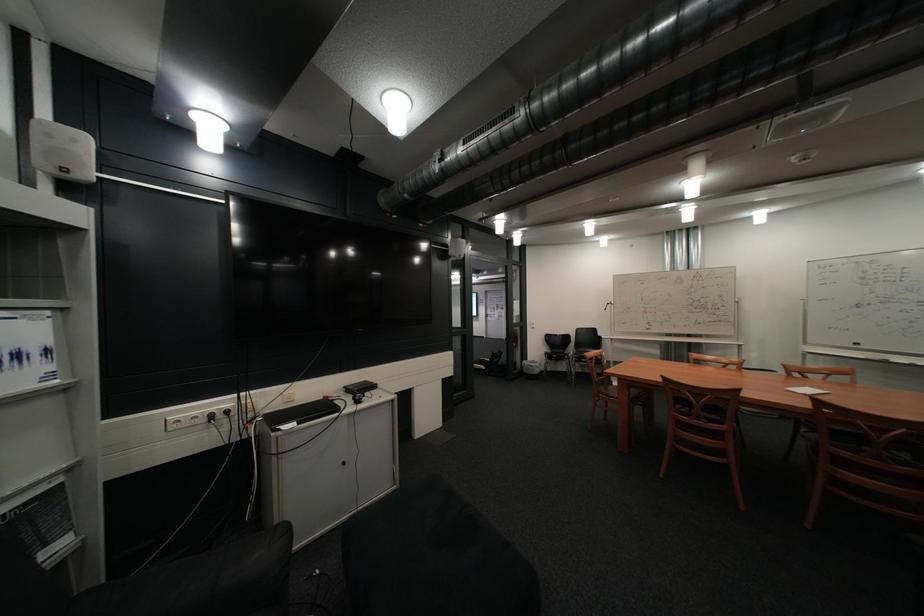
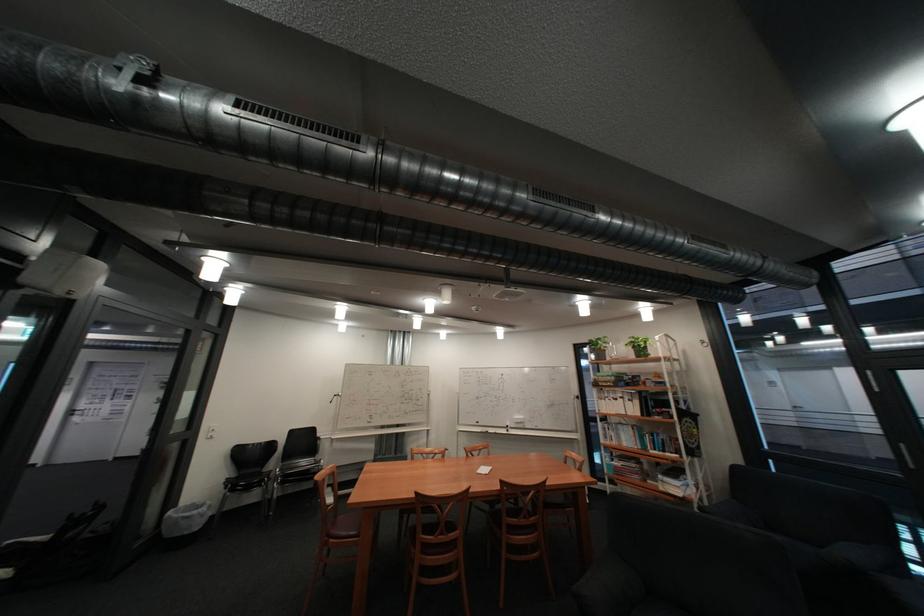
Based on the continuous images, in which direction is the camera rotating?

The rotation direction of the camera is right-up.